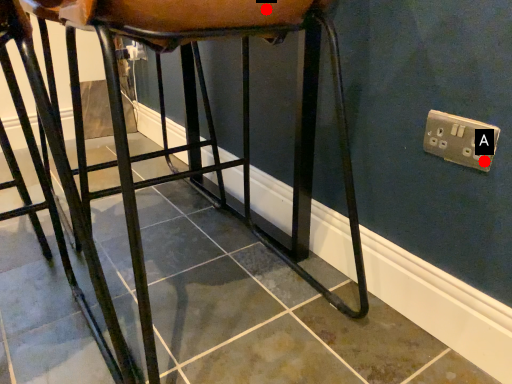
Question: Two points are circled on the image, labeled by A and B beside each circle. Which point is farther from the camera taking this photo?

Choices:
 (A) A is further
 (B) B is further

Answer: (A)